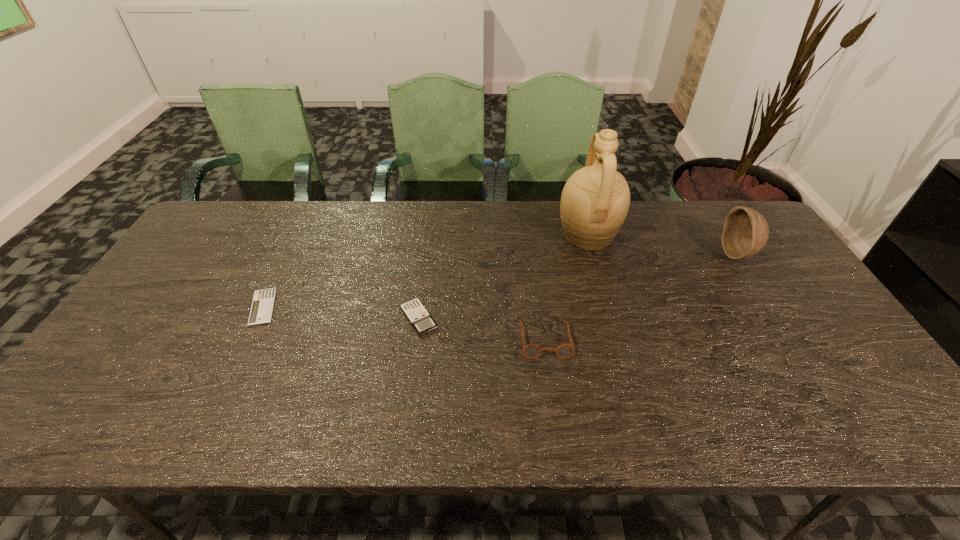
I want to click on free spot between the spectacles and the shortest object, so click(x=404, y=323).

You are a GUI agent. You are given a task and a screenshot of the screen. Output one action in this format:
    pyautogui.click(x=<x>, y=<y>)
    Task: Click on the free space between the fourth shortest object and the shortest object
    
    Given the screenshot: What is the action you would take?
    pyautogui.click(x=500, y=280)

I want to click on free point between the third object from left to right and the pitcher, so click(x=566, y=288).

Select which object is the third closest to the third shortest object. Please provide its 2D coordinates. Your answer should be formatted as a tuple, i.e. [(x, y)], where the tuple contains the x and y coordinates of a point satisfying the conditions above.

[(745, 232)]

Locate an element on the screen. the fourth closest object to the second tallest object is located at coordinates (261, 310).

Find the location of a particular element. This screenshot has width=960, height=540. vacant space that satisfies the following two spatial constraints: 1. on the back side of the second shortest object; 2. on the left side of the tallest object is located at coordinates (429, 235).